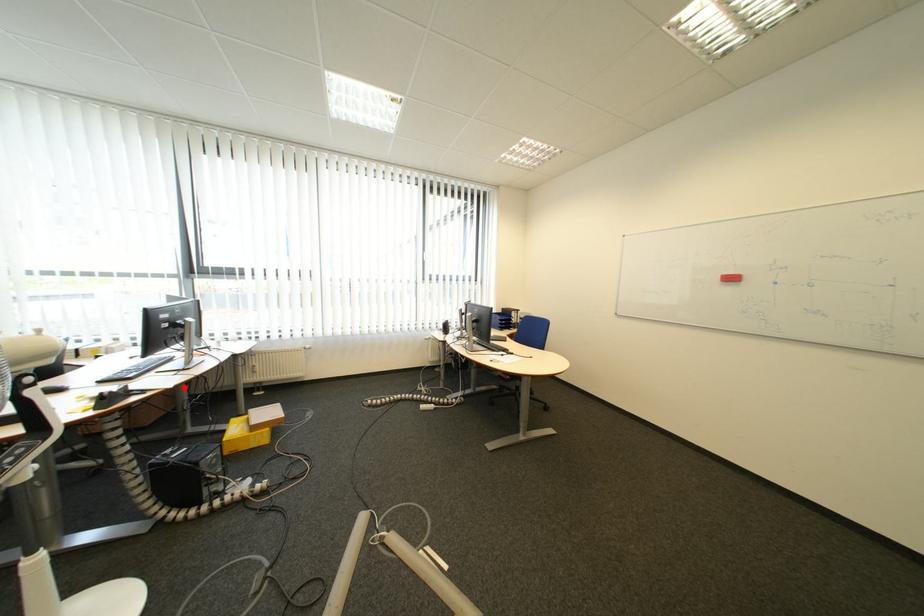
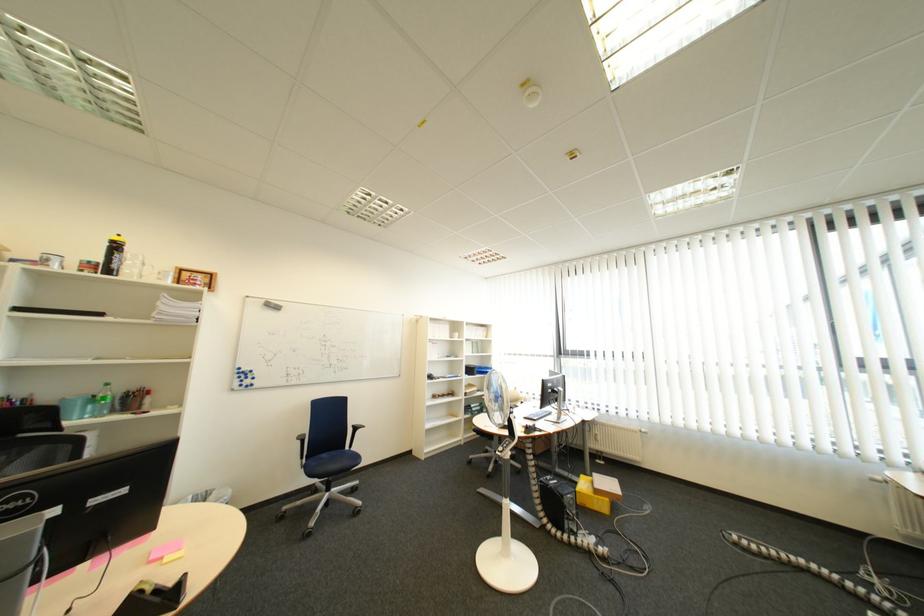
In the second image, find the point that corresponds to the highlighted location in the first image.

(565, 434)